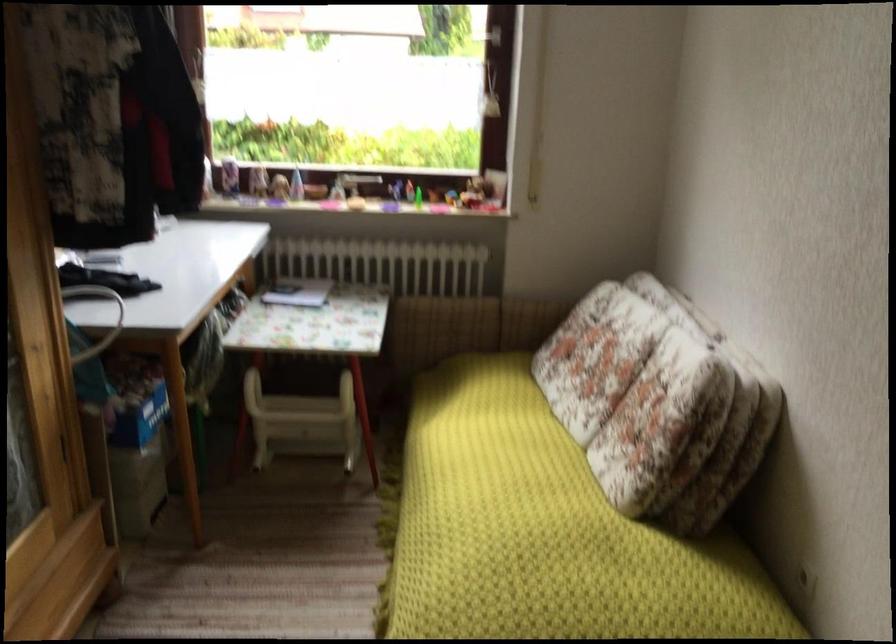
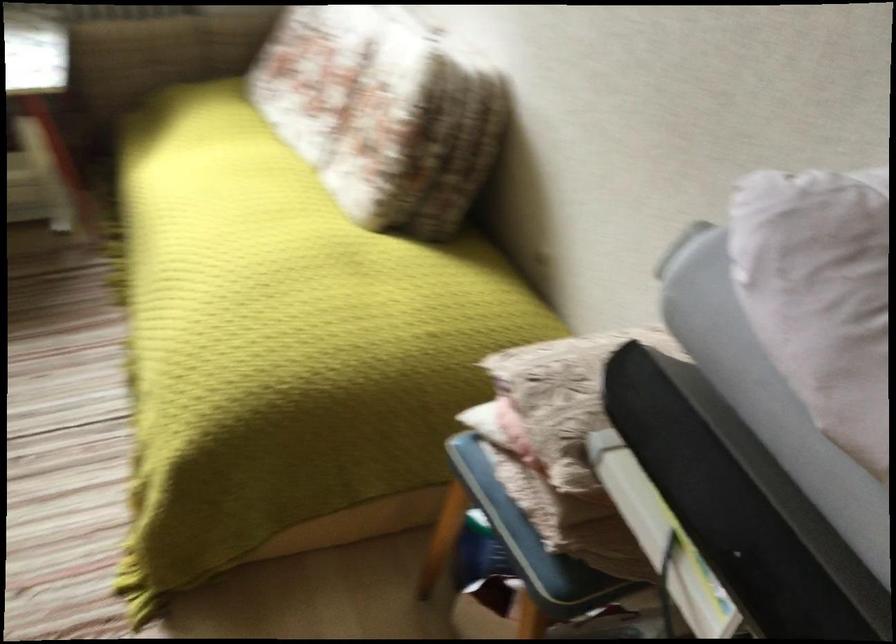
The images are taken continuously from a first-person perspective. In which direction are you moving?

The cameraman walked toward right, forward.